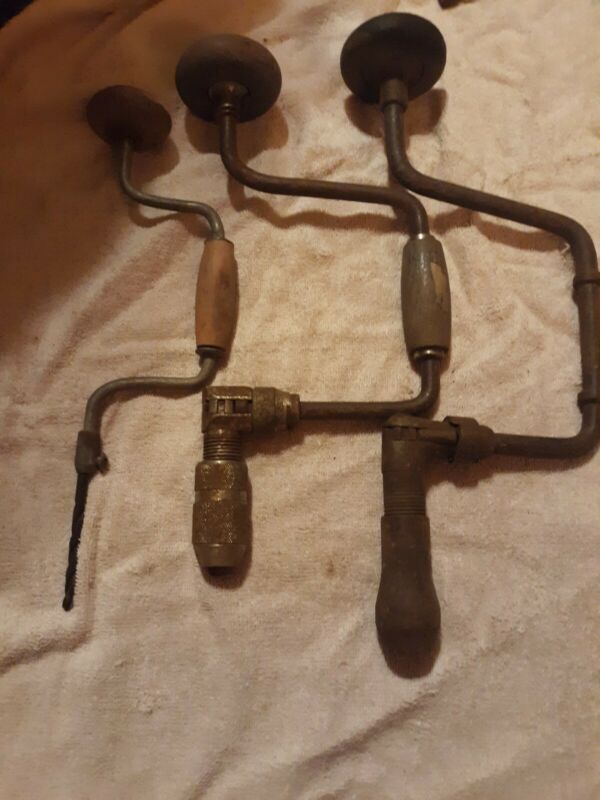
Image resolution: width=600 pixels, height=800 pixels. I want to click on crumb, so pos(264,40).